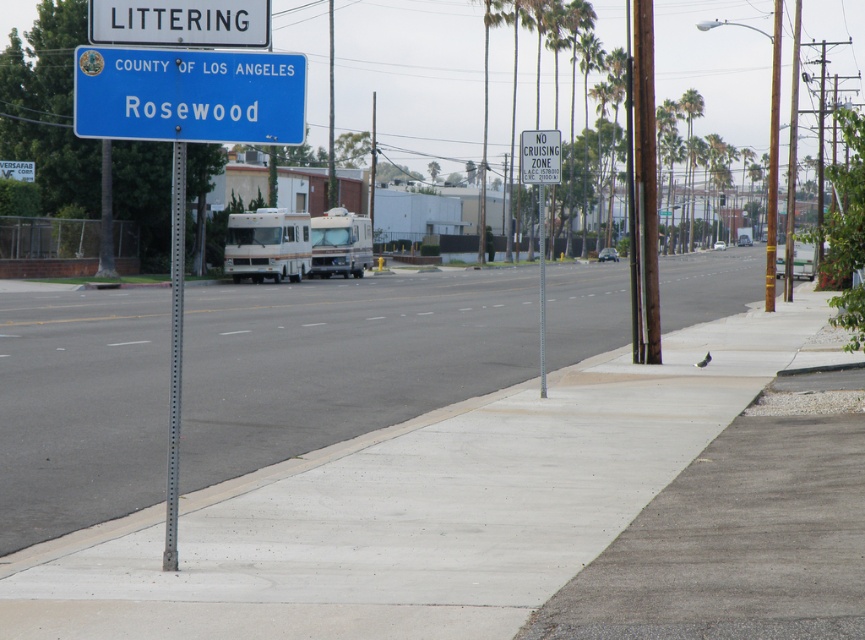
Is gray concrete sidewalk at center positioned at the back of blue metallic sign at upper center?

Yes, gray concrete sidewalk at center is further from the viewer.

Between gray concrete sidewalk at center and blue metallic sign at upper center, which one is positioned higher?

blue metallic sign at upper center is above.

Locate an element on the screen. This screenshot has height=640, width=865. gray concrete sidewalk at center is located at coordinates (341, 358).

This screenshot has width=865, height=640. Find the location of `gray concrete sidewalk at center`. gray concrete sidewalk at center is located at coordinates click(341, 358).

Consider the image. Is blue metallic sign at upper center wider than white plastic littering sign at upper center?

Yes, blue metallic sign at upper center is wider than white plastic littering sign at upper center.

Between blue metallic sign at upper center and white plastic littering sign at upper center, which one appears on the right side from the viewer's perspective?

From the viewer's perspective, blue metallic sign at upper center appears more on the right side.

Describe the element at coordinates (188, 93) in the screenshot. I see `blue metallic sign at upper center` at that location.

Locate an element on the screen. Image resolution: width=865 pixels, height=640 pixels. blue metallic sign at upper center is located at coordinates (188, 93).

Can you confirm if white plastic littering sign at upper center is smaller than metallic pole at center?

Correct, white plastic littering sign at upper center occupies less space than metallic pole at center.

Does white plastic littering sign at upper center have a lesser height compared to metallic pole at center?

Indeed, white plastic littering sign at upper center has a lesser height compared to metallic pole at center.

The width and height of the screenshot is (865, 640). I want to click on white plastic littering sign at upper center, so click(178, 22).